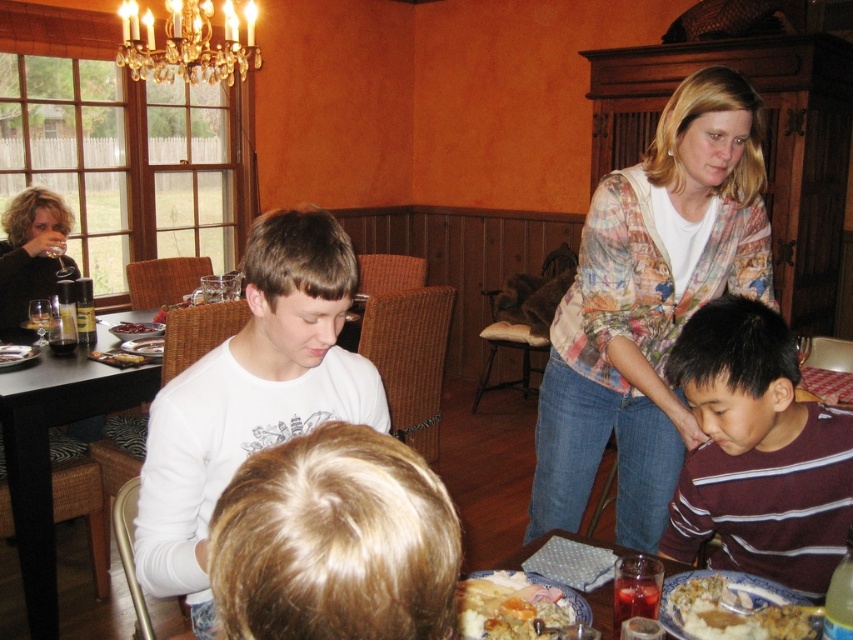
What is the object located at the coordinates point (648, 305) in the image?

The object located at point (648, 305) is the printed fabric shirt at upper right.

You are a guest at the dining table and want to pass a napkin from the printed fabric shirt at upper right to the golden mashed potato at lower right. Can you reach it without moving your seat?

The printed fabric shirt at upper right is closer to you than the golden mashed potato at lower right. Since it is further away, you might need to stretch or move your seat to reach the golden mashed potato at lower right.

You are a guest at this dinner and want to reach for the golden mashed potato at lower right without disturbing the dark brown sweater at upper left. Which direction should you move your hand to grab it?

The golden mashed potato at lower right is located below the dark brown sweater at upper left, so you should move your hand downward to grab it.